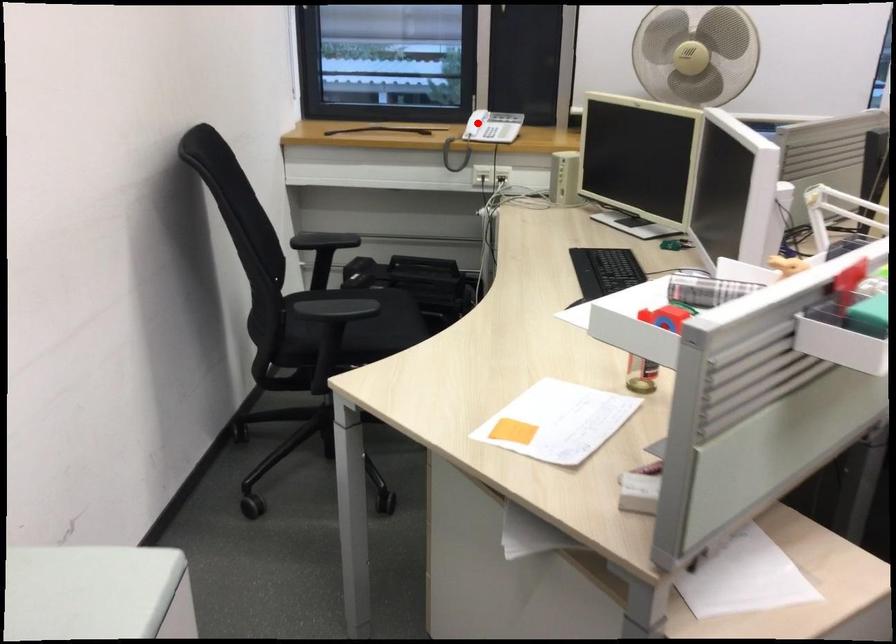
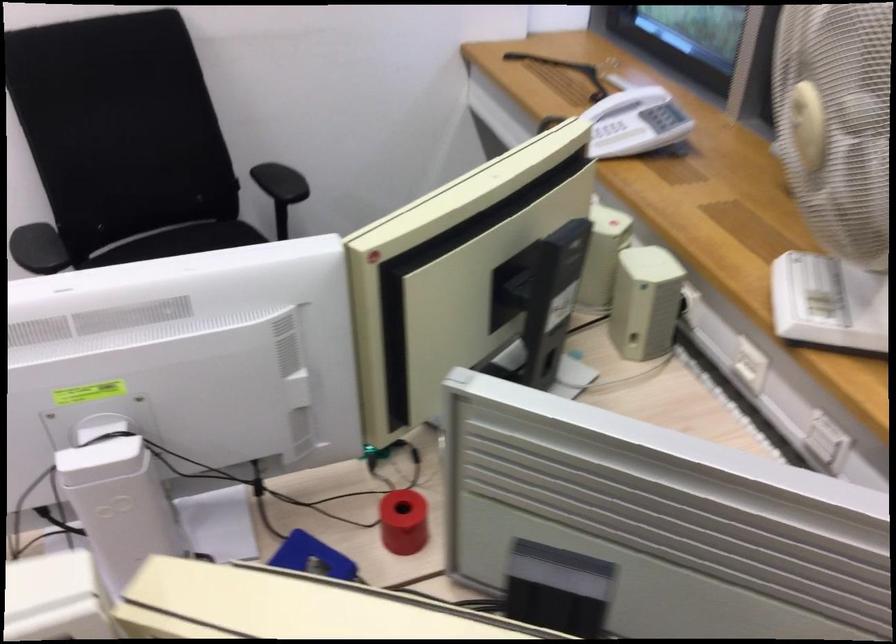
Where in the second image is the point corresponding to the highlighted location from the first image?

(612, 131)